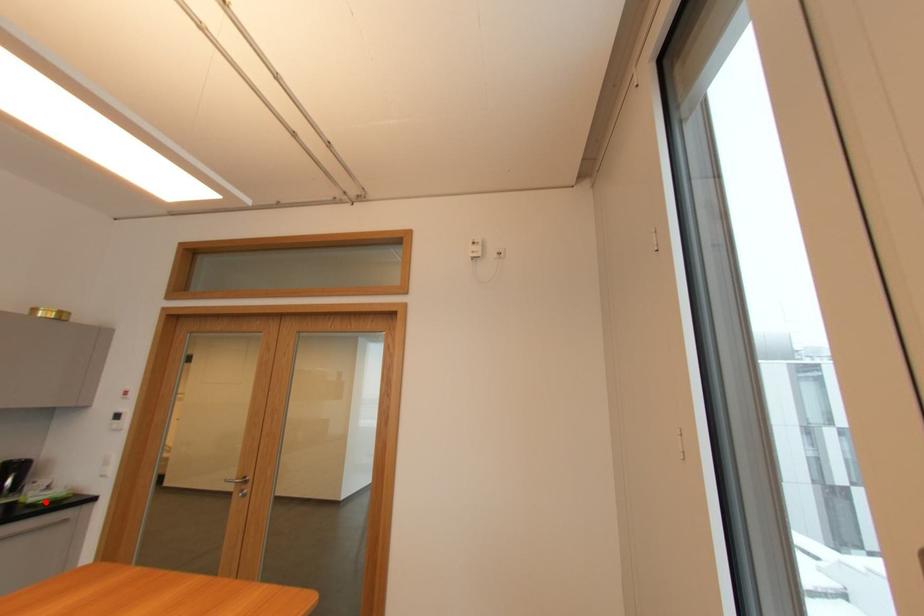
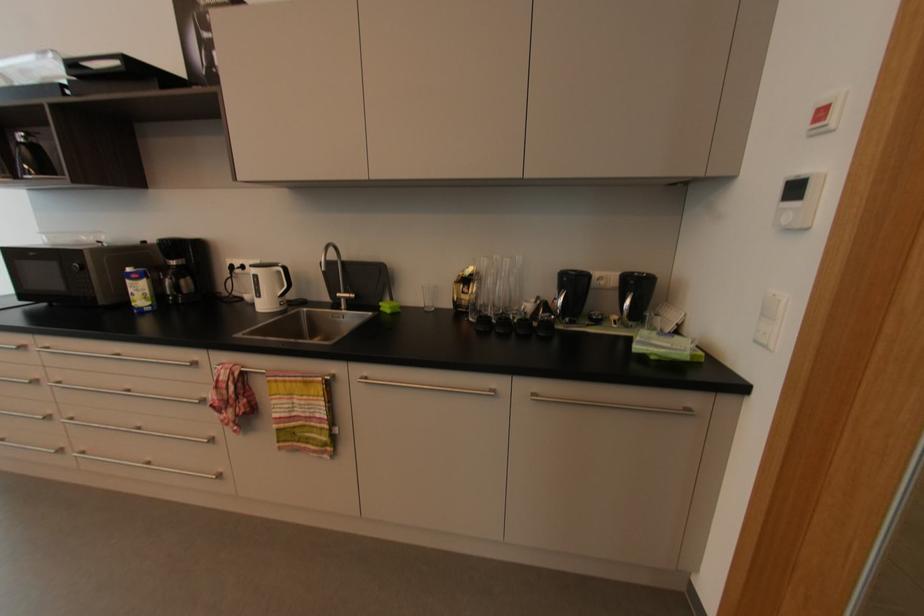
Where in the second image is the point corresponding to the highlighted location from the first image?

(657, 358)